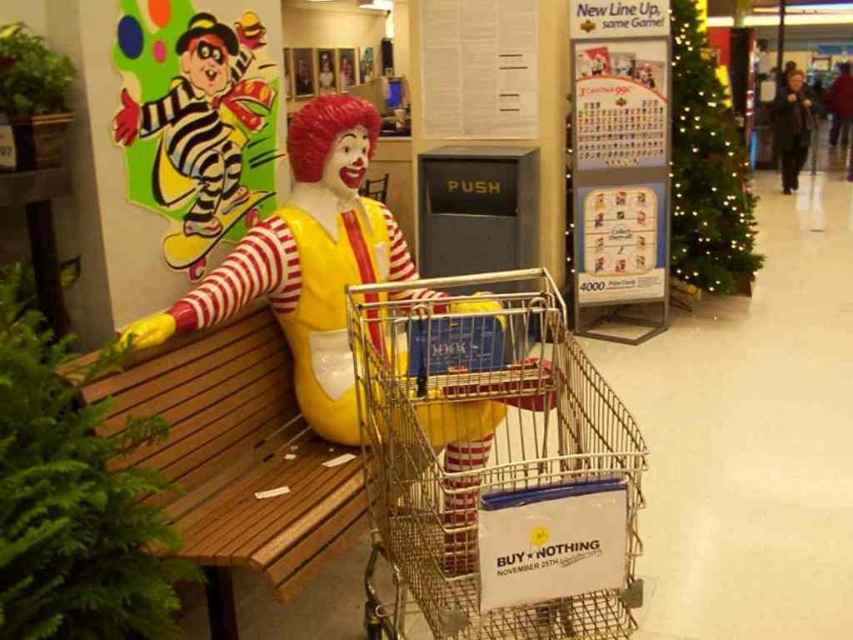
Question: Which point appears farthest from the camera in this image?

Choices:
 (A) (236, 154)
 (B) (544, 566)

Answer: (A)

Question: Is metallic silver shopping cart at center positioned in front of colorful paper clown at upper left?

Choices:
 (A) no
 (B) yes

Answer: (B)

Question: Which object is the closest to the dark gray sweater at right?

Choices:
 (A) metallic silver shopping cart at center
 (B) wooden bench at left

Answer: (A)

Question: Observing the image, what is the correct spatial positioning of colorful paper clown at upper left in reference to dark gray sweater at right?

Choices:
 (A) left
 (B) right

Answer: (A)

Question: Estimate the real-world distances between objects in this image. Which object is closer to the dark gray sweater at right?

Choices:
 (A) wooden bench at left
 (B) colorful paper clown at upper left

Answer: (B)

Question: Is wooden bench at left below dark gray sweater at right?

Choices:
 (A) no
 (B) yes

Answer: (B)